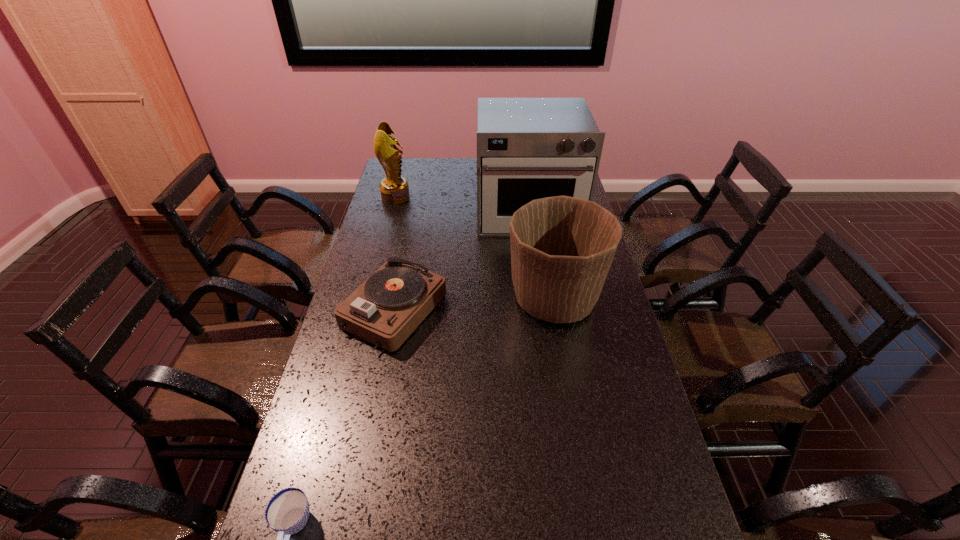
Where is `object that ranks as the third closest to the fourth tallest object`? This screenshot has height=540, width=960. object that ranks as the third closest to the fourth tallest object is located at coordinates (287, 512).

At what (x,y) coordinates should I click in order to perform the action: click on free spot that satisfies the following two spatial constraints: 1. on the back side of the fourth tallest object; 2. on the front-facing side of the award. Please return your answer as a coordinate pair (x, y). Looking at the image, I should click on (417, 197).

The image size is (960, 540). I want to click on vacant space that satisfies the following two spatial constraints: 1. on the front-facing side of the award; 2. on the back side of the flowerpot, so click(x=369, y=299).